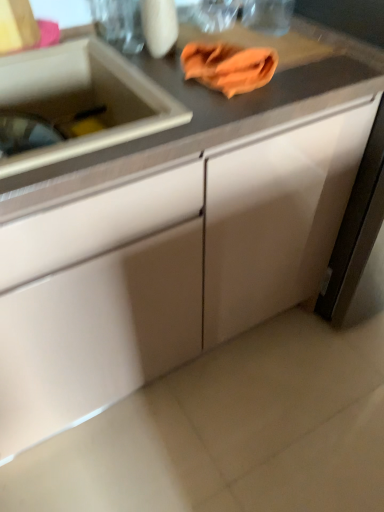
Question: Is white matte cabinet at right, the first cabinetry when ordered from right to left, in front of or behind white glossy sink at left in the image?

Choices:
 (A) behind
 (B) front

Answer: (A)

Question: From the image's perspective, is white matte cabinet at right, which is counted as the 2th cabinetry, starting from the left, positioned above or below white glossy sink at left?

Choices:
 (A) below
 (B) above

Answer: (B)

Question: Based on their relative distances, which object is nearer to the white glossy sink at left?

Choices:
 (A) white matte cabinet at right, the first cabinetry when ordered from right to left
 (B) orange cloth at upper center
 (C) matte white cabinet at center, the first cabinetry positioned from the left

Answer: (B)

Question: Estimate the real-world distances between objects in this image. Which object is closer to the white glossy sink at left?

Choices:
 (A) orange cloth at upper center
 (B) matte white cabinet at center, positioned as the second cabinetry in right-to-left order
 (C) white matte cabinet at right, which is counted as the 2th cabinetry, starting from the left

Answer: (A)